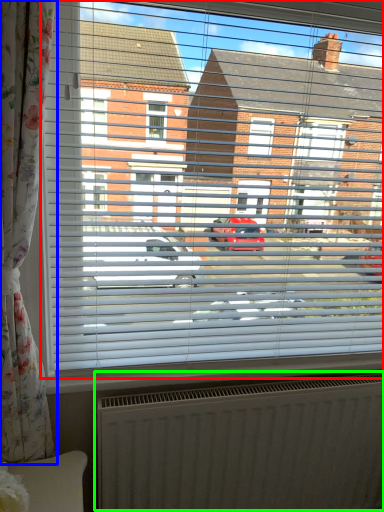
Question: Considering the real-world distances, which object is farthest from window (highlighted by a red box)? curtain (highlighted by a blue box) or radiator (highlighted by a green box)?

Choices:
 (A) curtain
 (B) radiator

Answer: (B)